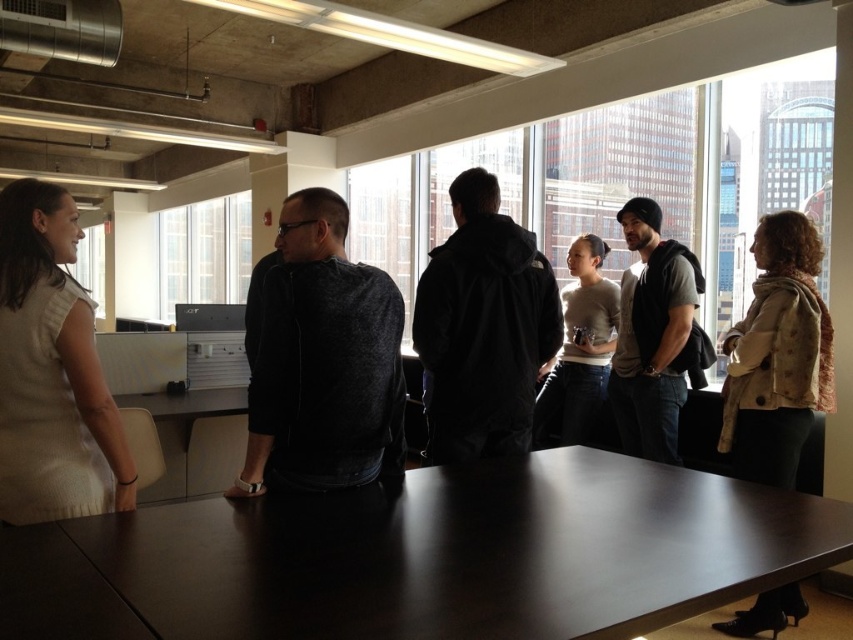
You are a delivery person trying to place a large box on the dark brown wooden table at center. The beige textured coat at right is hanging on a hook nearby. Can the box be placed on the table without the coat interfering?

The dark brown wooden table at center is not as tall as the beige textured coat at right, so the coat is taller. Since the coat is hanging nearby, its height might block access to the table. You should check if the coat is hanging close enough to the table to interfere when placing the box.

You are organizing a meeting in this office space and need to seat everyone comfortably around the dark brown wooden table at center. Considering the light beige sleeveless top at left is worn by one of the attendees, will the table be wide enough to accommodate all six people?

The dark brown wooden table at center is wider than the light beige sleeveless top at left, but the description does not provide specific measurements for the table or the number of people it can seat. Therefore, it is unclear if the table will be wide enough to accommodate all six people comfortably.